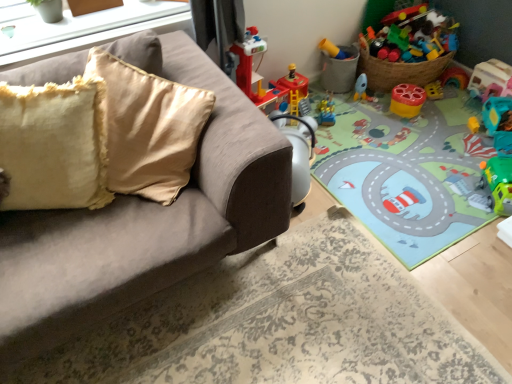
This screenshot has width=512, height=384. I want to click on free space that is to the left of yellow plastic cup at center-right, acting as the 4th toy starting from the right, so click(377, 110).